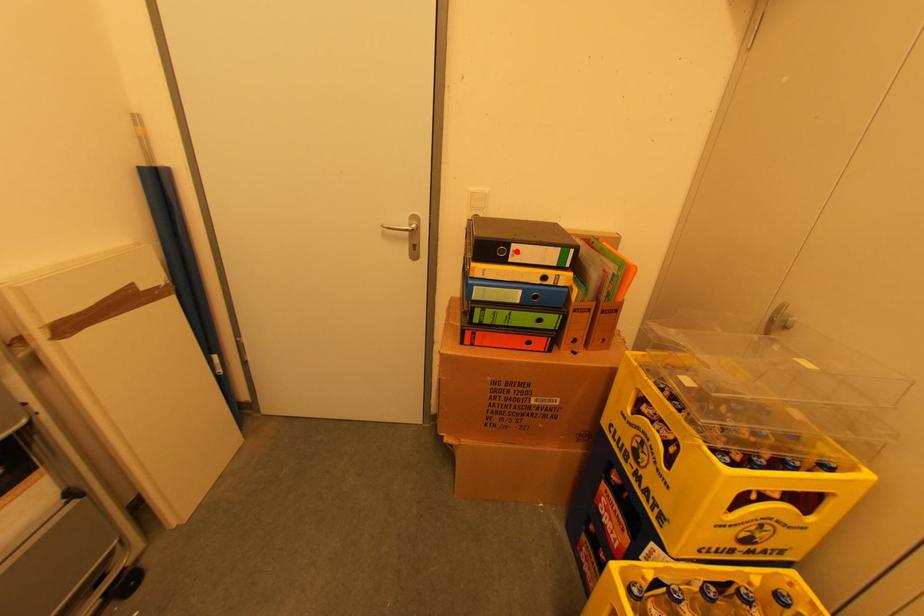
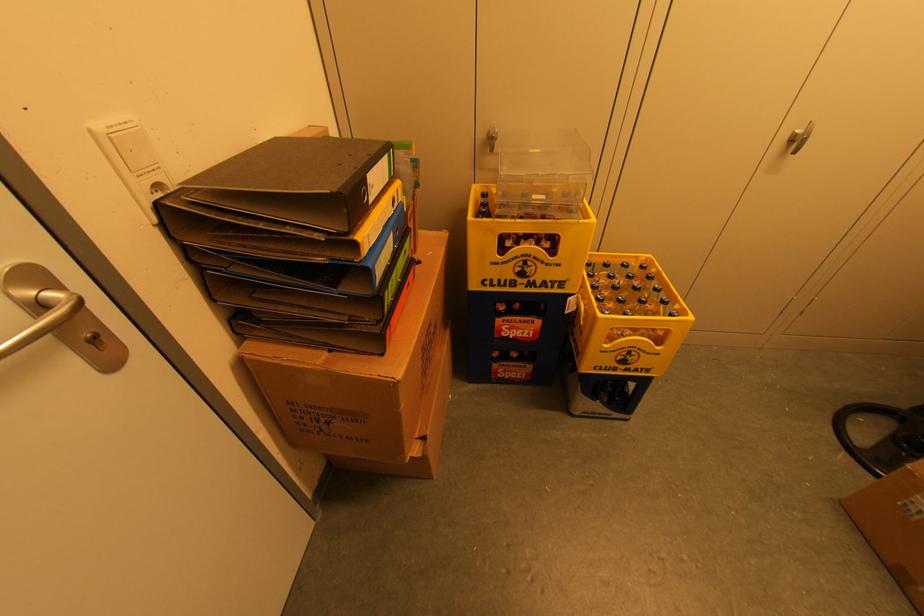
Locate, in the second image, the point that corresponds to the highlighted location in the first image.

(371, 185)